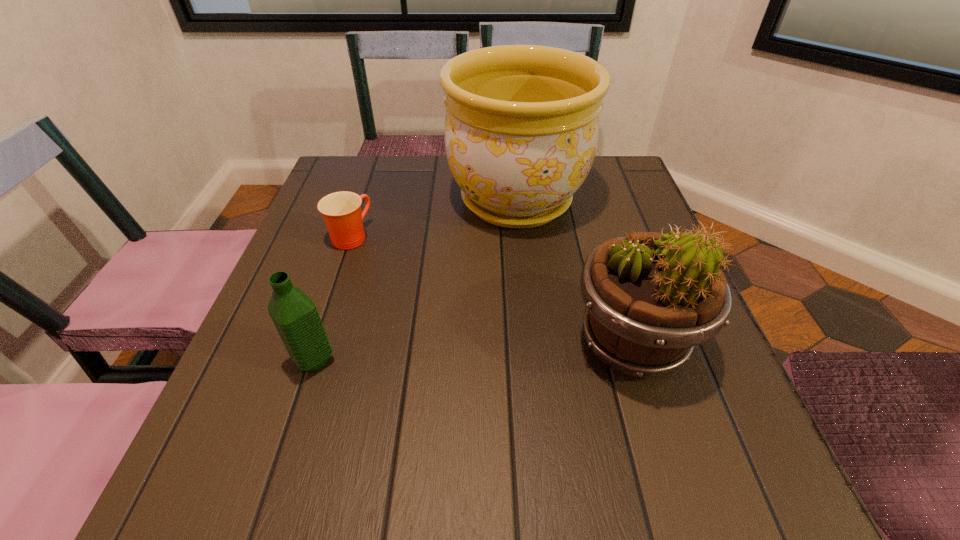
Where is `free space that satisfies the following two spatial constraints: 1. on the front side of the nearer flowerpot; 2. on the right side of the cup`? The image size is (960, 540). free space that satisfies the following two spatial constraints: 1. on the front side of the nearer flowerpot; 2. on the right side of the cup is located at coordinates (315, 343).

The image size is (960, 540). In order to click on vacant space that satisfies the following two spatial constraints: 1. on the front side of the shortest object; 2. on the left side of the third tallest object in this screenshot , I will do `click(309, 360)`.

This screenshot has width=960, height=540. In order to click on vacant space that satisfies the following two spatial constraints: 1. on the front side of the farther flowerpot; 2. on the left side of the nearer flowerpot in this screenshot , I will do `click(531, 343)`.